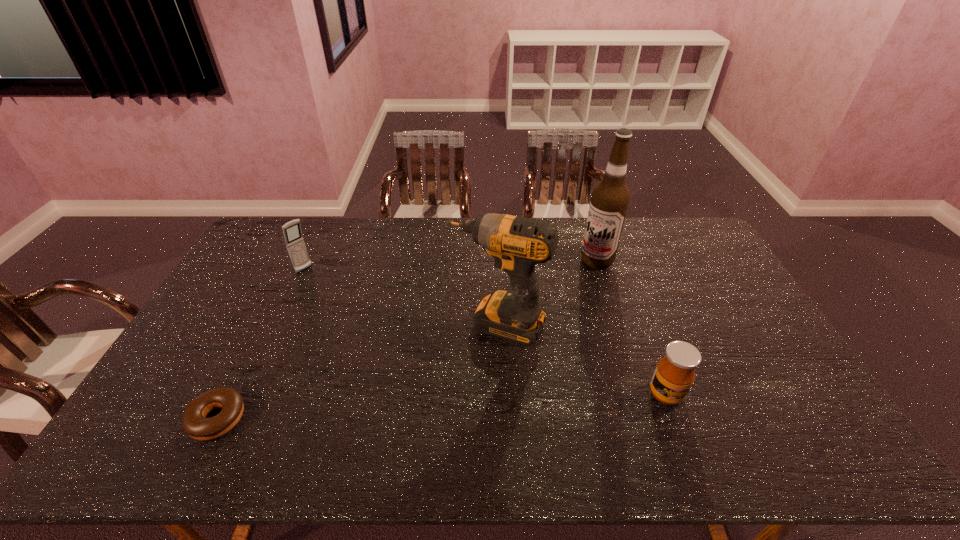
Locate an element on the screen. The width and height of the screenshot is (960, 540). vacant area situated 0.150m with the drill bit of the second tallest object facing forward is located at coordinates (459, 388).

The image size is (960, 540). Find the location of `free space located 0.120m with the drill bit of the second tallest object facing forward`. free space located 0.120m with the drill bit of the second tallest object facing forward is located at coordinates (463, 379).

Find the location of a particular element. The width and height of the screenshot is (960, 540). free space located 0.230m with the drill bit of the second tallest object facing forward is located at coordinates (446, 413).

This screenshot has width=960, height=540. What are the coordinates of `blank area located on the label of the tallest object` in the screenshot? It's located at (569, 286).

This screenshot has width=960, height=540. Identify the location of free space located on the label of the tallest object. (519, 331).

This screenshot has height=540, width=960. I want to click on vacant space situated 0.330m on the label of the tallest object, so click(532, 320).

Where is `object at the far edge`? object at the far edge is located at coordinates (609, 201).

What are the coordinates of `doughnut that is at the near edge` in the screenshot? It's located at coord(194,423).

The width and height of the screenshot is (960, 540). In order to click on honey that is positioned at the near edge in this screenshot , I will do `click(674, 375)`.

The width and height of the screenshot is (960, 540). I want to click on object situated at the left edge, so click(x=194, y=423).